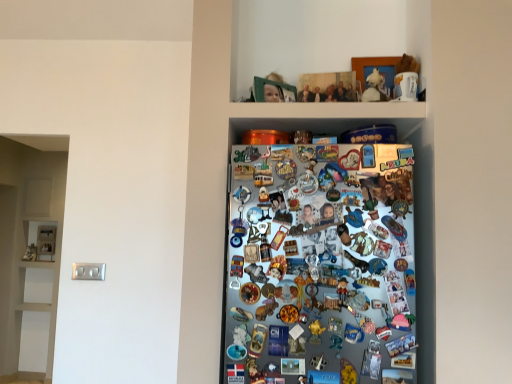
Question: Would you say white plush toy at upper center, the second toy positioned from the front, contains gold plastic toy at center, which ranks as the 1th toy in front-to-back order?

Choices:
 (A) yes
 (B) no

Answer: (B)

Question: From the image's perspective, is white plush toy at upper center, positioned as the 2th toy in left-to-right order, located beneath gold plastic toy at center, the second toy viewed from the back?

Choices:
 (A) no
 (B) yes

Answer: (A)

Question: Does white plush toy at upper center, the first toy when ordered from back to front, lie behind gold plastic toy at center, the first toy ordered from the bottom?

Choices:
 (A) yes
 (B) no

Answer: (A)

Question: Considering the relative sizes of white plush toy at upper center, acting as the first toy starting from the top, and gold plastic toy at center, the second toy positioned from the top, in the image provided, is white plush toy at upper center, acting as the first toy starting from the top, smaller than gold plastic toy at center, the second toy positioned from the top,?

Choices:
 (A) no
 (B) yes

Answer: (A)

Question: Considering the relative positions of white plush toy at upper center, which is the first toy from right to left, and gold plastic toy at center, the second toy viewed from the back, in the image provided, is white plush toy at upper center, which is the first toy from right to left, in front of gold plastic toy at center, the second toy viewed from the back,?

Choices:
 (A) no
 (B) yes

Answer: (A)

Question: From the image's perspective, would you say gold plastic toy at center, the second toy positioned from the top, is positioned over white plush toy at upper center, the first toy when ordered from back to front?

Choices:
 (A) yes
 (B) no

Answer: (B)

Question: Considering the relative sizes of gold plastic toy at center, which ranks as the 1th toy in front-to-back order, and white plush toy at upper center, acting as the first toy starting from the top, in the image provided, is gold plastic toy at center, which ranks as the 1th toy in front-to-back order, wider than white plush toy at upper center, acting as the first toy starting from the top,?

Choices:
 (A) no
 (B) yes

Answer: (A)

Question: Is gold plastic toy at center, the second toy positioned from the top, not inside white plush toy at upper center, acting as the first toy starting from the top?

Choices:
 (A) yes
 (B) no

Answer: (A)

Question: Is gold plastic toy at center, the second toy in the right-to-left sequence, oriented towards white plush toy at upper center, which is the first toy from right to left?

Choices:
 (A) no
 (B) yes

Answer: (A)

Question: From the image's perspective, is gold plastic toy at center, the second toy positioned from the top, located beneath white plush toy at upper center, acting as the first toy starting from the top?

Choices:
 (A) yes
 (B) no

Answer: (A)

Question: Does gold plastic toy at center, the second toy positioned from the top, appear on the right side of white plush toy at upper center, the first toy when ordered from back to front?

Choices:
 (A) no
 (B) yes

Answer: (A)

Question: Looking at their shapes, would you say white plush toy at upper center, the second toy positioned from the front, is wider or thinner than gold plastic toy at center, the first toy when ordered from left to right?

Choices:
 (A) thin
 (B) wide

Answer: (B)